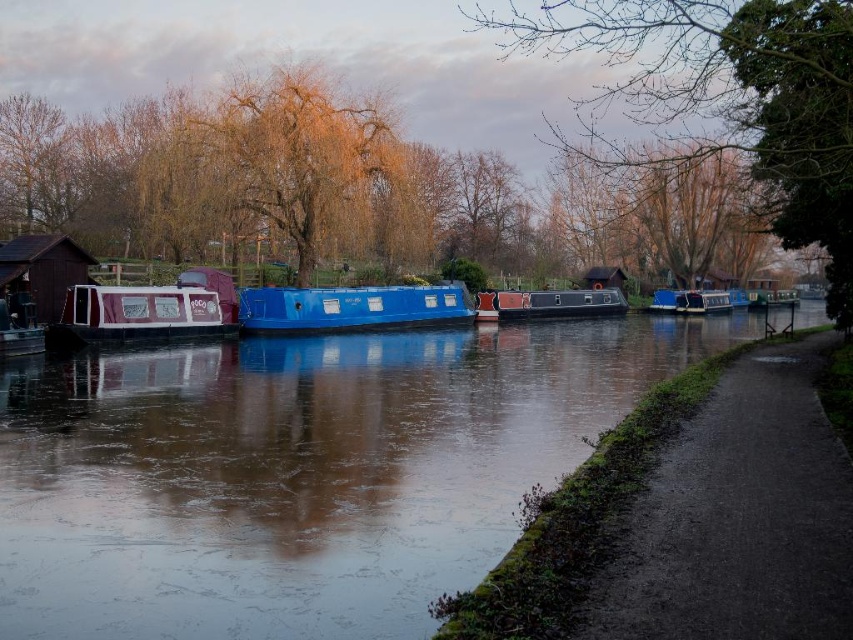
Question: Estimate the real-world distances between objects in this image. Which object is farther from the blue glossy boat at center?

Choices:
 (A) glossy blue water at center
 (B) maroon fabric boat at left
 (C) matte black barge at center

Answer: (C)

Question: Is blue glossy boat at center wider than matte black barge at center?

Choices:
 (A) yes
 (B) no

Answer: (A)

Question: Can you confirm if glossy blue water at center is thinner than matte black barge at center?

Choices:
 (A) no
 (B) yes

Answer: (A)

Question: Among these objects, which one is farthest from the camera?

Choices:
 (A) glossy blue water at center
 (B) blue glossy houseboat at center
 (C) maroon fabric boat at left

Answer: (B)

Question: Which point is closer to the camera?

Choices:
 (A) (102, 340)
 (B) (679, 291)

Answer: (A)

Question: Is maroon fabric boat at left to the right of blue glossy boat at center from the viewer's perspective?

Choices:
 (A) no
 (B) yes

Answer: (A)